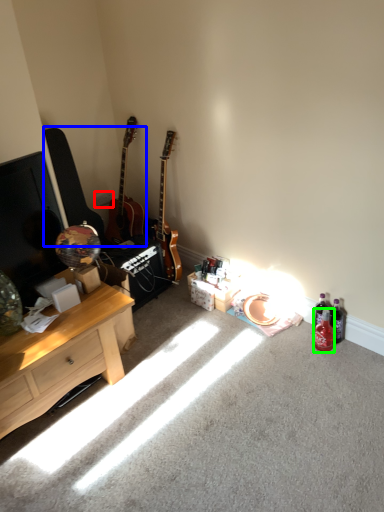
Question: Estimate the real-world distances between objects in this image. Which object is closer to power outlet (highlighted by a red box), guitars (highlighted by a blue box) or bottle (highlighted by a green box)?

Choices:
 (A) guitars
 (B) bottle

Answer: (A)